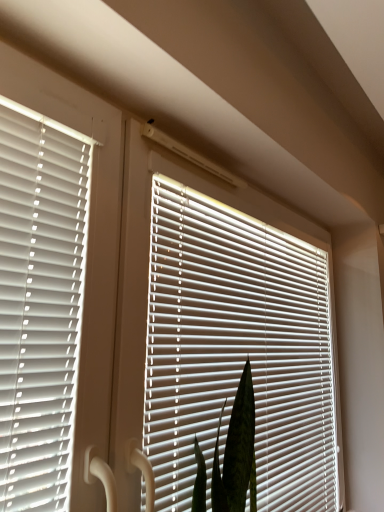
In order to face white plastic blinds at center, should I rotate leftwards or rightwards?

A 9.958 degree turn to the right will do.

What is the approximate height of white plastic blinds at center?

white plastic blinds at center is 3.34 feet in height.

What do you see at coordinates (236, 350) in the screenshot?
I see `white plastic blinds at center` at bounding box center [236, 350].

In order to click on white plastic blinds at center in this screenshot , I will do `click(236, 350)`.

This screenshot has height=512, width=384. Find the location of `white plastic blinds at center`. white plastic blinds at center is located at coordinates (236, 350).